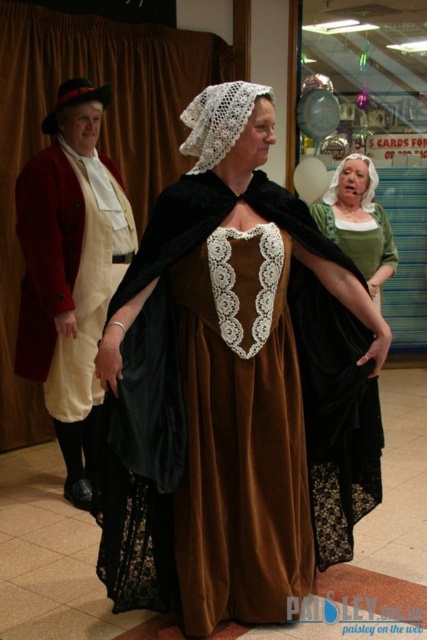
Question: Is brown velvet dress at center closer to the viewer compared to matte white coat at left?

Choices:
 (A) no
 (B) yes

Answer: (B)

Question: Can you confirm if matte white coat at left is positioned to the left of velvet green dress at center?

Choices:
 (A) yes
 (B) no

Answer: (A)

Question: Among these objects, which one is nearest to the camera?

Choices:
 (A) matte white coat at left
 (B) velvet green dress at center

Answer: (A)

Question: Is brown velvet dress at center closer to the viewer compared to matte white coat at left?

Choices:
 (A) no
 (B) yes

Answer: (B)

Question: Which of the following is the closest to the observer?

Choices:
 (A) brown velvet dress at center
 (B) matte white coat at left

Answer: (A)

Question: Which of the following is the farthest from the observer?

Choices:
 (A) (248, 525)
 (B) (49, 371)
 (C) (316, 525)

Answer: (B)